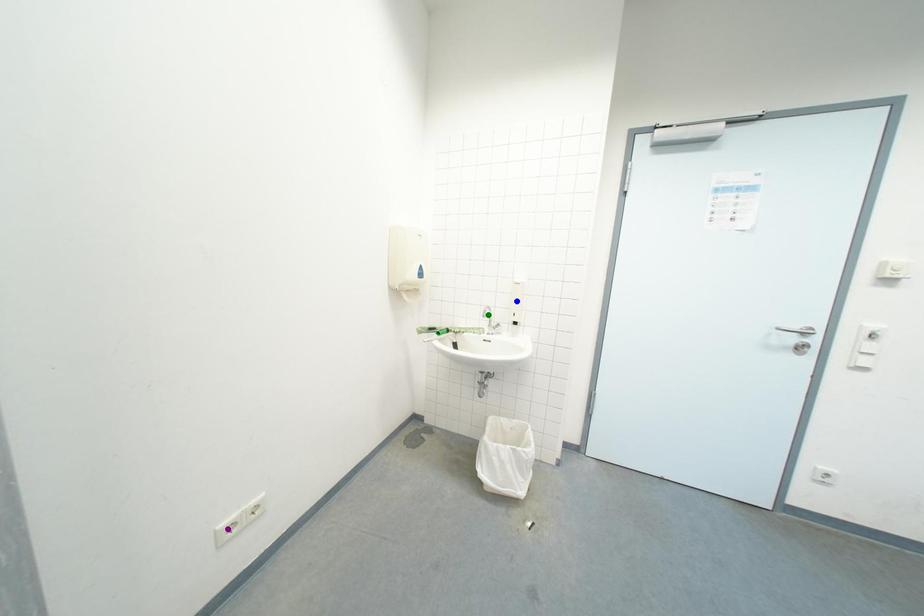
Order these from nearest to farthest:
- green point
- purple point
- blue point

1. purple point
2. green point
3. blue point